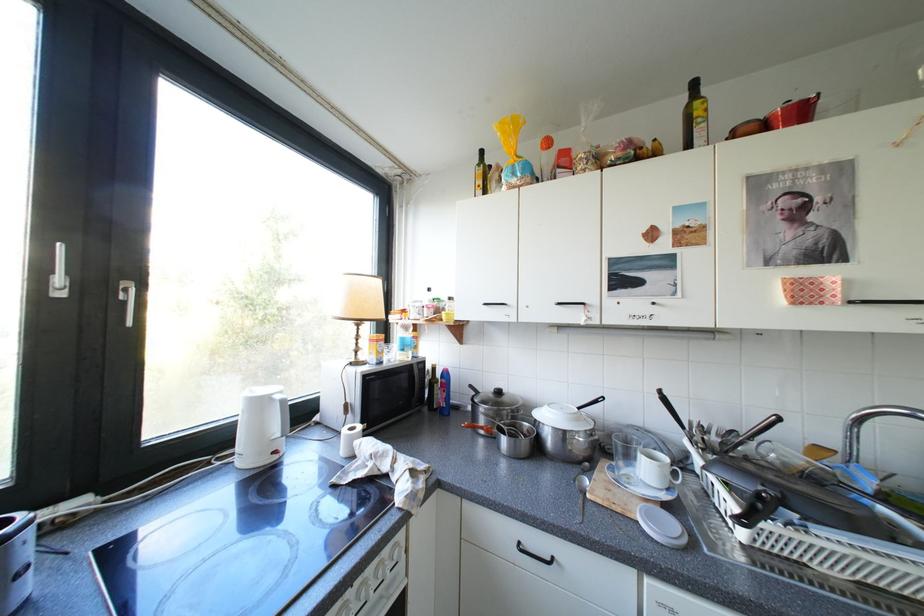
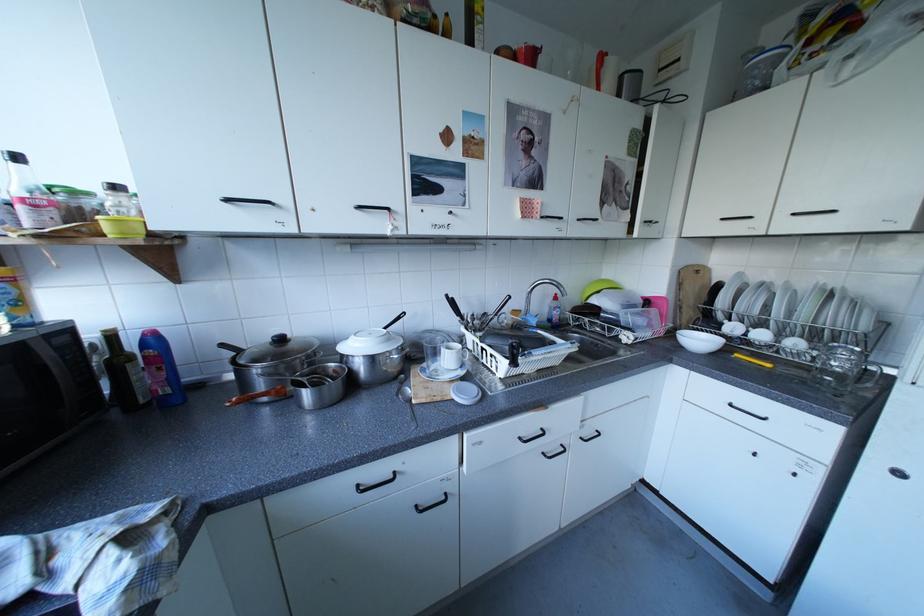
Find the pixel in the second image that matches point (496, 423) in the first image.

(281, 386)